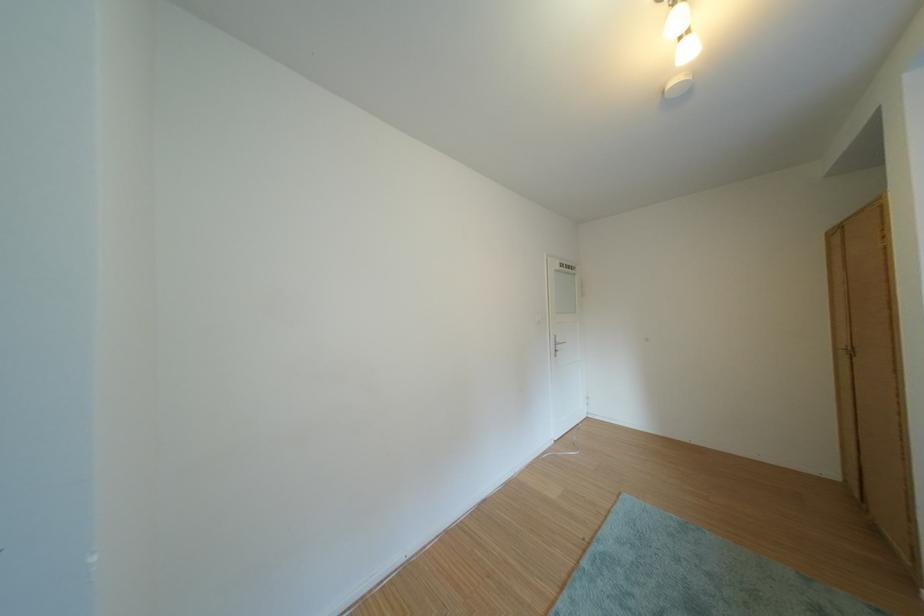
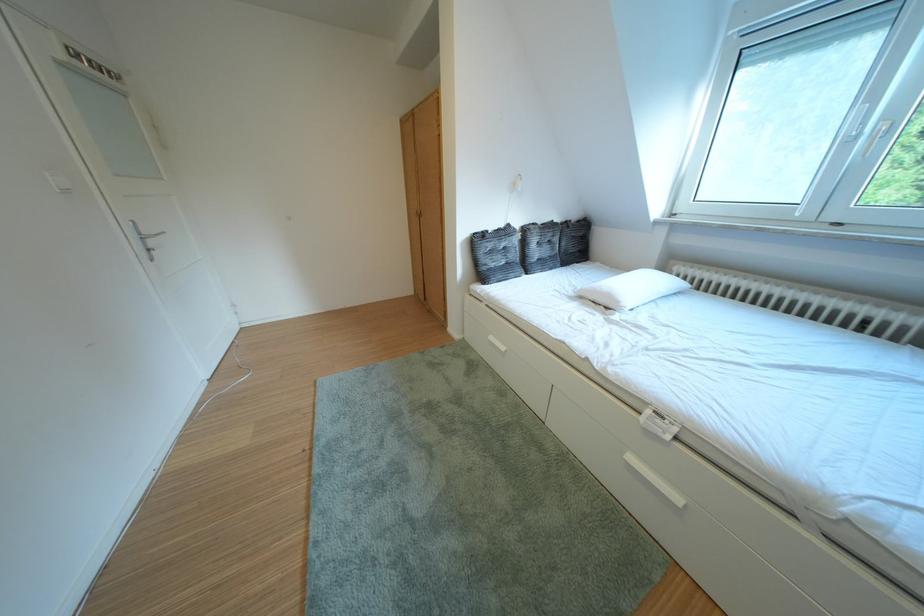
Looking at this image, based on the continuous images, in which direction is the camera rotating?

The camera rotated toward right-down.